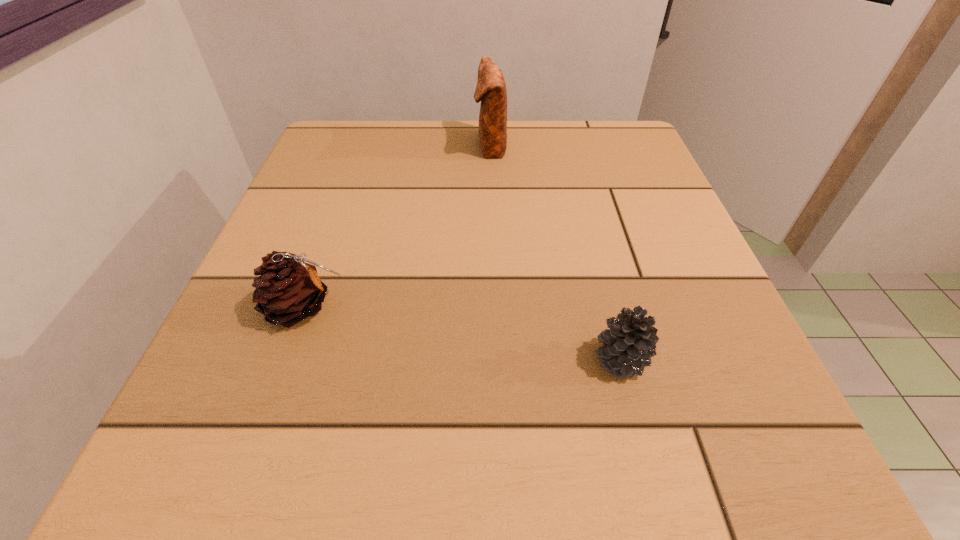
Where is `blank region between the farthest object and the right pinecone`? This screenshot has width=960, height=540. blank region between the farthest object and the right pinecone is located at coordinates (555, 253).

Locate an element on the screen. This screenshot has height=540, width=960. object that is the second closest one to the right pinecone is located at coordinates [491, 90].

Locate an element on the screen. Image resolution: width=960 pixels, height=540 pixels. object identified as the second closest to the tallest object is located at coordinates (629, 344).

This screenshot has width=960, height=540. In order to click on vacant area in the image that satisfies the following two spatial constraints: 1. with a leaf charm attached to the left pinecone; 2. on the back side of the nearer pinecone in this screenshot , I will do `click(285, 359)`.

Find the location of `free space that satisfies the following two spatial constraints: 1. with a leaf charm attached to the second farthest object; 2. on the right side of the nearest object`. free space that satisfies the following two spatial constraints: 1. with a leaf charm attached to the second farthest object; 2. on the right side of the nearest object is located at coordinates (285, 359).

Locate an element on the screen. The width and height of the screenshot is (960, 540). free space in the image that satisfies the following two spatial constraints: 1. on the open side of the right pinecone; 2. on the left side of the clutch bag is located at coordinates (496, 359).

I want to click on free spot that satisfies the following two spatial constraints: 1. on the open side of the second object from right to left; 2. on the back side of the rightmost object, so click(x=496, y=359).

In order to click on free location that satisfies the following two spatial constraints: 1. with a leaf charm attached to the left pinecone; 2. on the back side of the right pinecone in this screenshot , I will do `click(285, 359)`.

Identify the location of blank space that satisfies the following two spatial constraints: 1. on the back side of the rightmost object; 2. on the open side of the farthest object. (564, 146).

Identify the location of blank area in the image that satisfies the following two spatial constraints: 1. with a leaf charm attached to the rightmost object; 2. on the right side of the left pinecone. (285, 359).